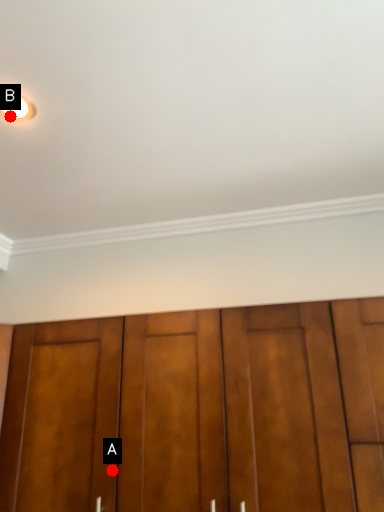
Question: Two points are circled on the image, labeled by A and B beside each circle. Which point appears closest to the camera in this image?

Choices:
 (A) A is closer
 (B) B is closer

Answer: (B)